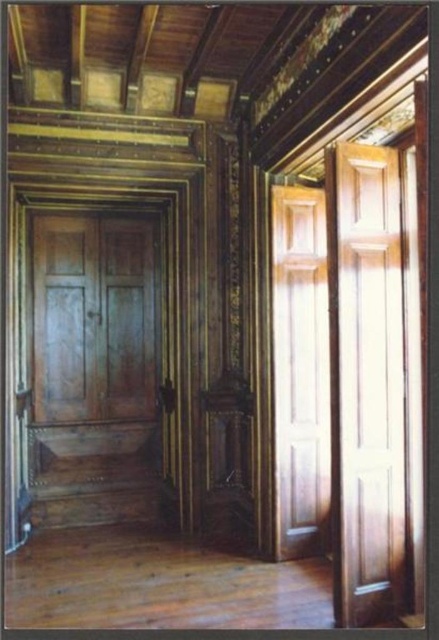
Question: Is glossy wood door at right to the left of wooden paneling at right from the viewer's perspective?

Choices:
 (A) yes
 (B) no

Answer: (B)

Question: Which object is farther from the camera taking this photo?

Choices:
 (A) glossy wood door at right
 (B) wooden paneling at right
 (C) wooden panelled door at center

Answer: (C)

Question: Does glossy wood door at right have a lesser width compared to wooden paneling at right?

Choices:
 (A) yes
 (B) no

Answer: (B)

Question: Which point is closer to the camera taking this photo?

Choices:
 (A) pyautogui.click(x=308, y=420)
 (B) pyautogui.click(x=356, y=364)

Answer: (B)

Question: Based on their relative distances, which object is nearer to the glossy wood door at right?

Choices:
 (A) wooden panelled door at center
 (B) wooden paneling at right

Answer: (B)

Question: Is wooden panelled door at center to the right of wooden paneling at right from the viewer's perspective?

Choices:
 (A) no
 (B) yes

Answer: (A)